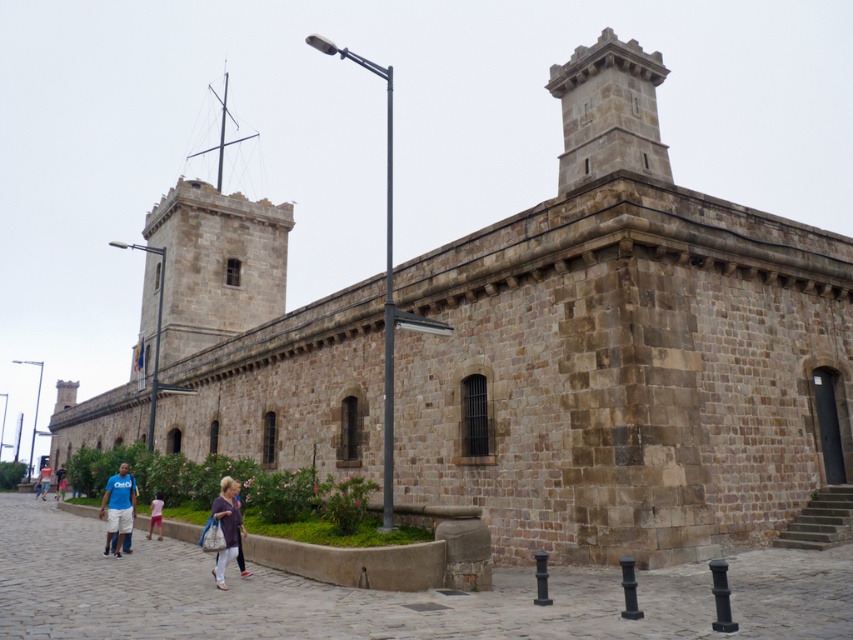
Question: Is gray stone tower at upper right positioned in front of matte purple shirt at center?

Choices:
 (A) yes
 (B) no

Answer: (B)

Question: Which object is positioned closest to the light blue denim shorts at lower left?

Choices:
 (A) gray stone tower at upper right
 (B) blue denim jeans at lower left
 (C) pink fabric at lower center
 (D) matte purple shirt at center

Answer: (B)

Question: Which point is farther to the camera?

Choices:
 (A) (155, 499)
 (B) (123, 483)
 (C) (218, 516)

Answer: (A)

Question: Which object is closer to the camera taking this photo?

Choices:
 (A) matte purple shirt at center
 (B) matte blue shirt at lower left
 (C) pink fabric at lower center

Answer: (A)

Question: Can you confirm if matte blue shirt at lower left is wider than light blue denim shorts at lower left?

Choices:
 (A) no
 (B) yes

Answer: (A)

Question: In this image, where is matte blue shirt at lower left located relative to pink fabric at lower center?

Choices:
 (A) left
 (B) right

Answer: (A)